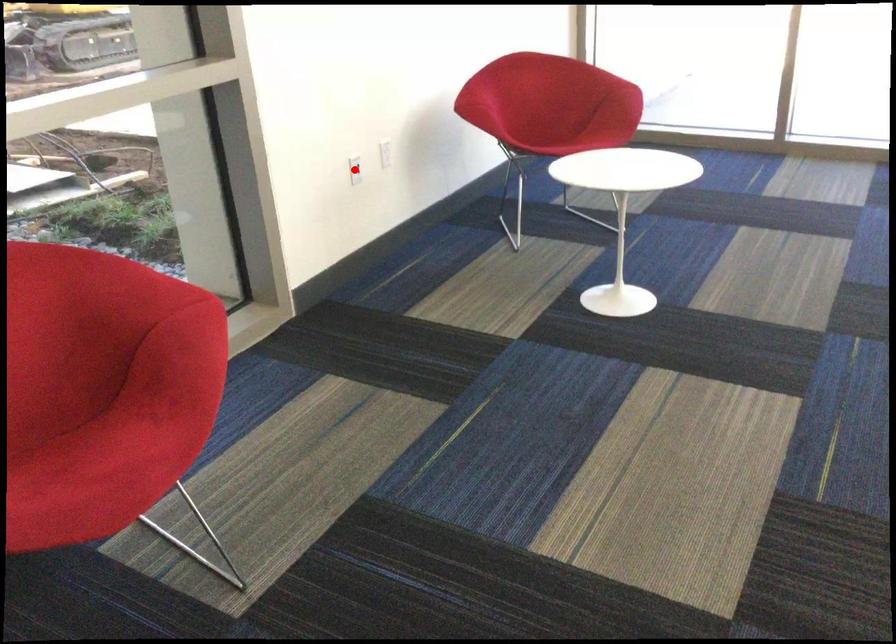
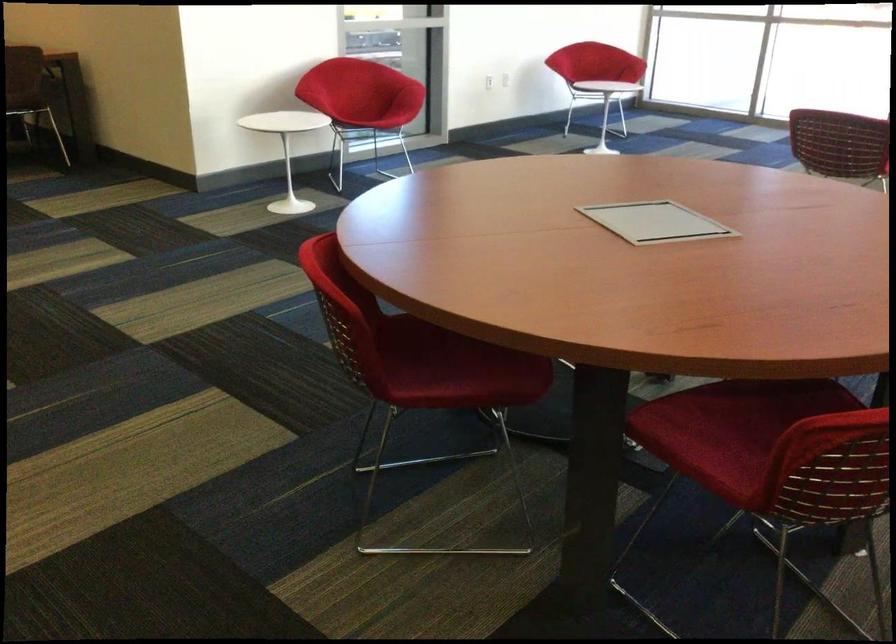
Question: I am providing you with two images of the same scene from different viewpoints. A red point is marked on the first image. At the location where the point appears in image 1, is it still visible in image 2?

Choices:
 (A) Yes
 (B) No

Answer: (B)